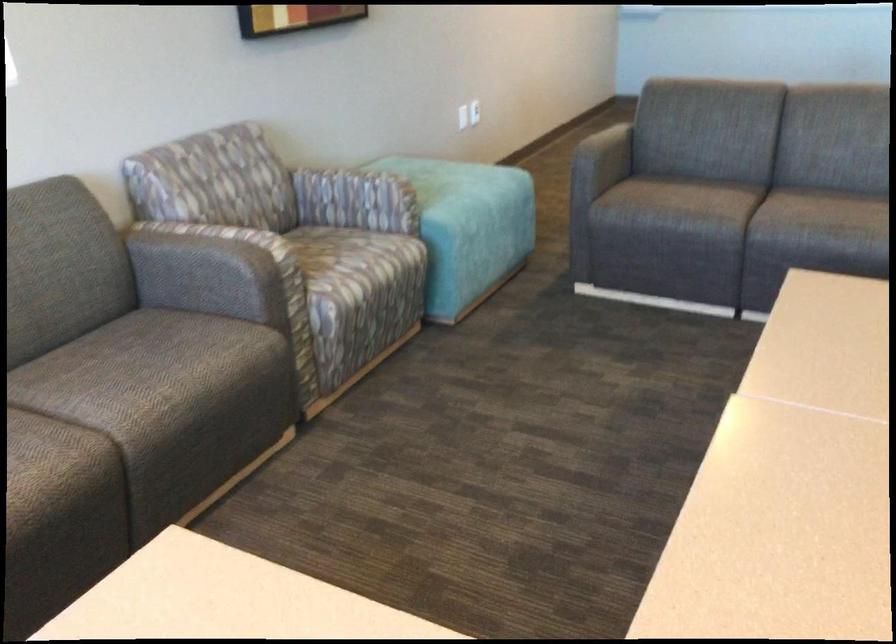
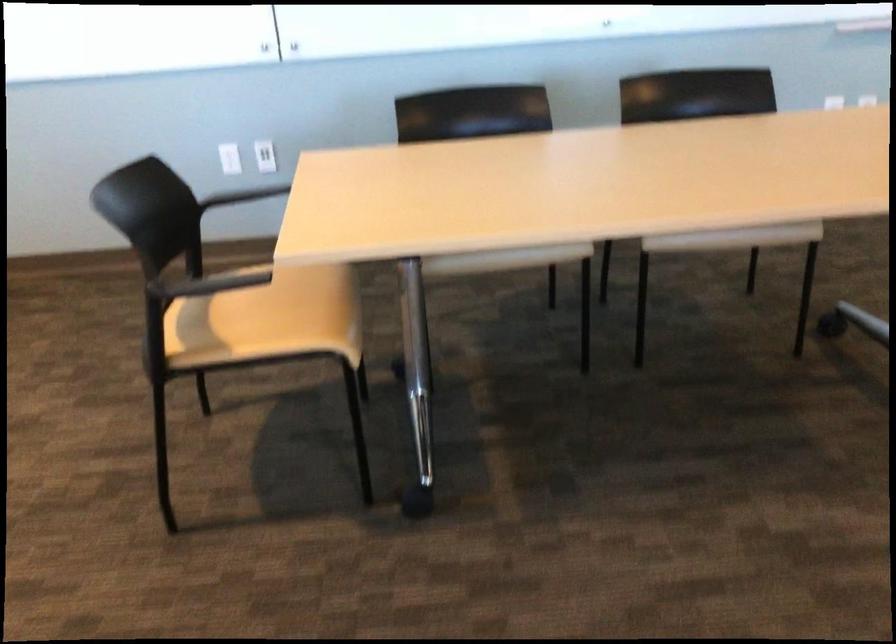
Which direction would the cameraman need to move to produce the second image?

The cameraman walked toward right, forward.